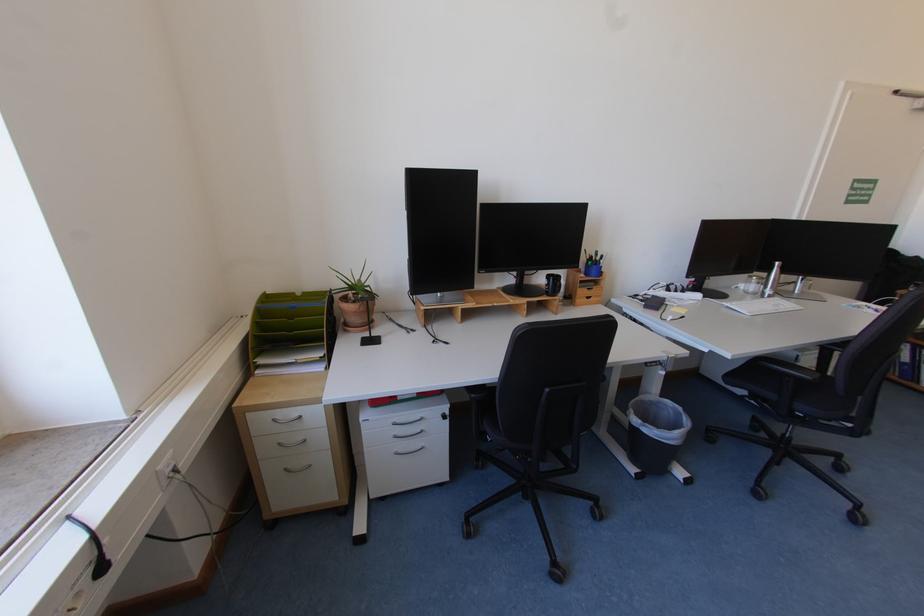
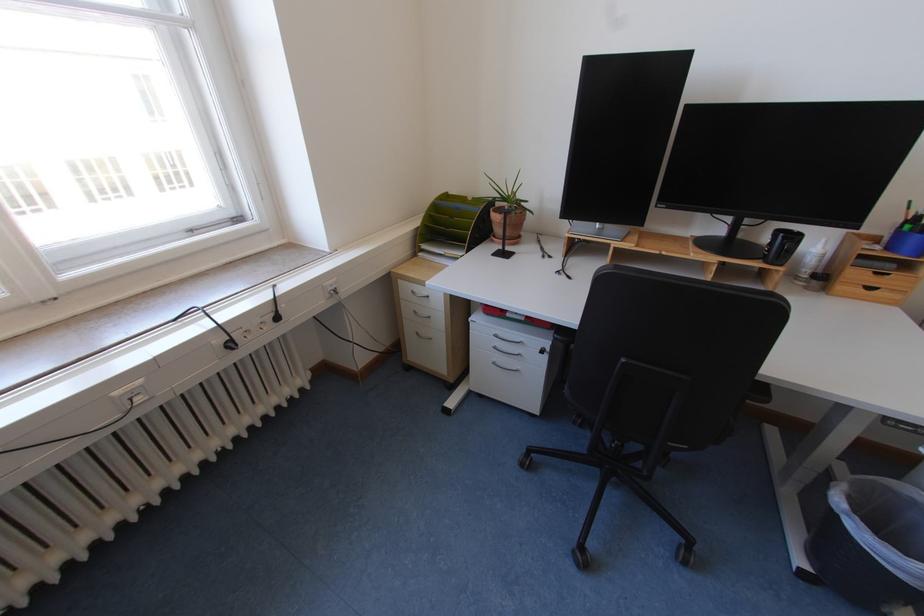
In the second image, find the point that corresponds to pixel 553 296 in the first image.

(769, 262)